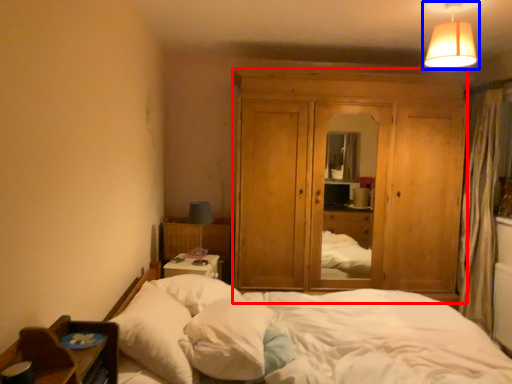
Question: Which object is closer to the camera taking this photo, dresser (highlighted by a red box) or lamp (highlighted by a blue box)?

Choices:
 (A) dresser
 (B) lamp

Answer: (B)